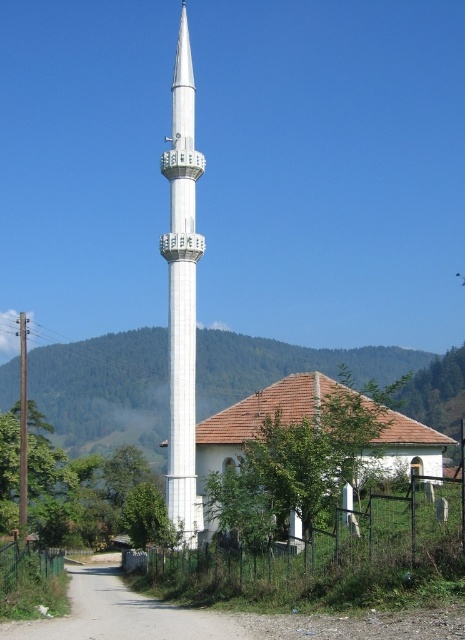
Is metallic wire fence at lower center thinner than white tile roof at center?

Indeed, metallic wire fence at lower center has a lesser width compared to white tile roof at center.

Does point (312, 540) lie behind point (230, 461)?

No, it is in front of (230, 461).

Find the location of a particular element. Image resolution: width=465 pixels, height=640 pixels. metallic wire fence at lower center is located at coordinates (332, 544).

Between metallic wire fence at lower center and white smooth minaret at center, which one is positioned higher?

Positioned higher is white smooth minaret at center.

The image size is (465, 640). What do you see at coordinates (332, 544) in the screenshot?
I see `metallic wire fence at lower center` at bounding box center [332, 544].

Where is `metallic wire fence at lower center`? The image size is (465, 640). metallic wire fence at lower center is located at coordinates (332, 544).

Is the position of white tile roof at center more distant than that of green wire mesh fence at lower left?

Yes, white tile roof at center is further from the viewer.

Measure the distance between white tile roof at center and camera.

white tile roof at center is 71.86 meters from camera.

Find the location of a particular element. white tile roof at center is located at coordinates (253, 428).